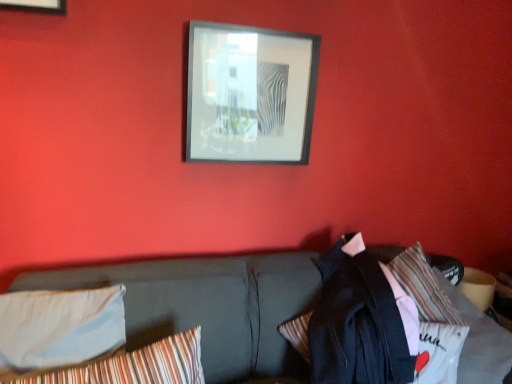
Question: Considering the positions of light blue fabric pillow at lower left, the 1th pillow when ordered from left to right, and dark gray fabric couch at center in the image, is light blue fabric pillow at lower left, the 1th pillow when ordered from left to right, bigger or smaller than dark gray fabric couch at center?

Choices:
 (A) big
 (B) small

Answer: (B)

Question: Relative to dark gray fabric couch at center, is light blue fabric pillow at lower left, the 1th pillow when ordered from left to right, in front or behind?

Choices:
 (A) behind
 (B) front

Answer: (A)

Question: Which of these objects is positioned farthest from the dark blue fabric jacket at lower right?

Choices:
 (A) light blue fabric pillow at lower left, the 1th pillow when ordered from left to right
 (B) dark gray fabric couch at center
 (C) striped fabric pillow at lower left, placed as the second pillow when sorted from left to right
 (D) black matte picture frame at upper center

Answer: (A)

Question: Estimate the real-world distances between objects in this image. Which object is closer to the dark blue fabric jacket at lower right?

Choices:
 (A) striped fabric pillow at lower left, placed as the second pillow when sorted from left to right
 (B) black matte picture frame at upper center
 (C) dark gray fabric couch at center
 (D) light blue fabric pillow at lower left, the 1th pillow when ordered from left to right

Answer: (C)